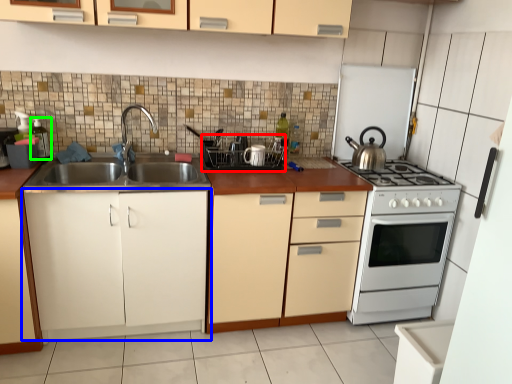
Question: Estimate the real-world distances between objects in this image. Which object is farther from appliance (highlighted by a red box), cabinetry (highlighted by a blue box) or appliance (highlighted by a green box)?

Choices:
 (A) cabinetry
 (B) appliance

Answer: (B)